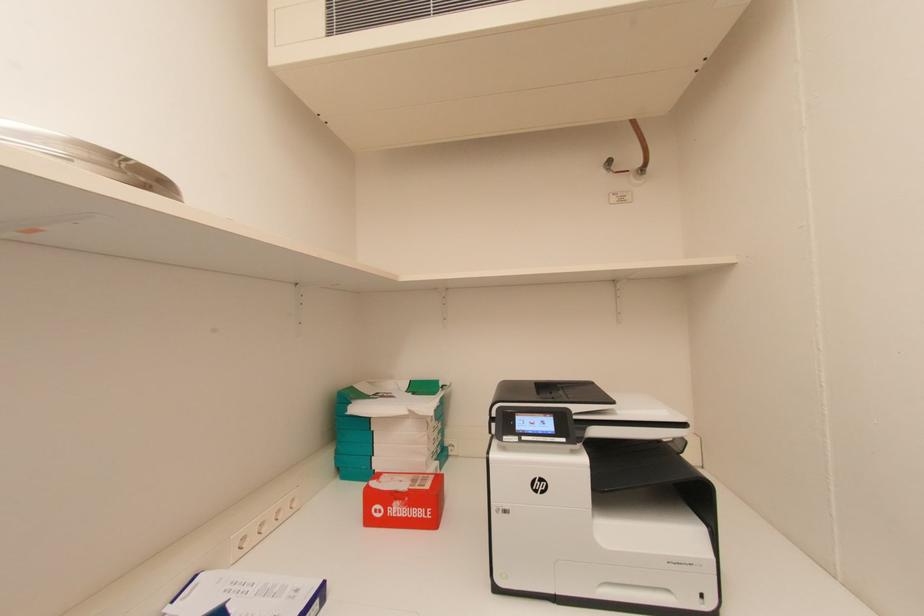
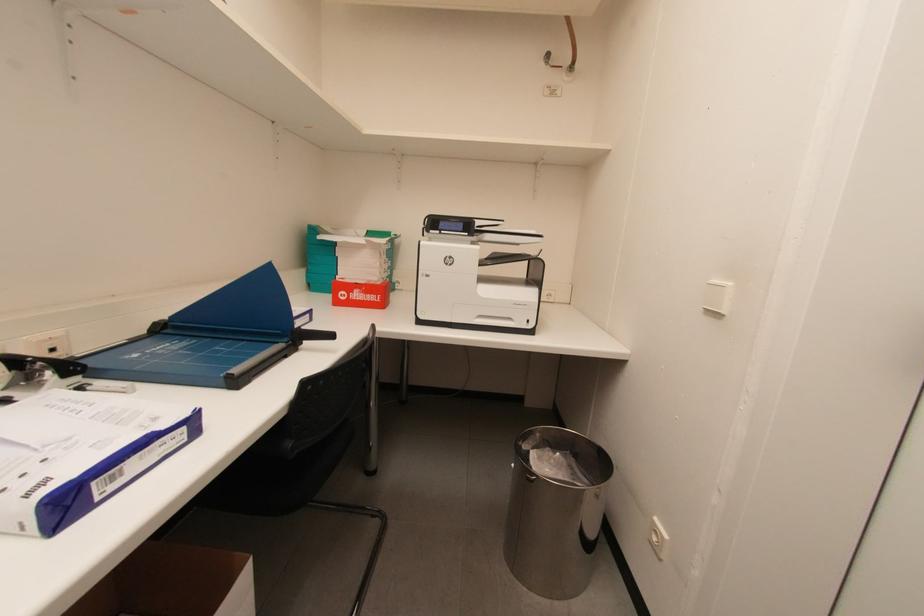
Question: Which direction would the cameraman need to move to produce the second image? Reply with the corresponding letter.

Choices:
 (A) Left
 (B) Right
 (C) Forward
 (D) Backward

Answer: (D)